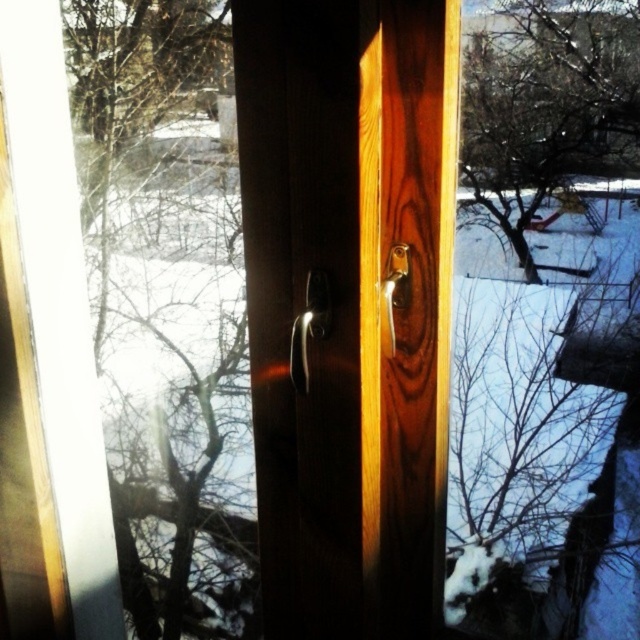
Question: Which is nearer to the satin wood door handle at center?

Choices:
 (A) polished metallic door handle at center
 (B) polished brass door handle at center

Answer: (A)

Question: Is satin wood door handle at center behind polished metallic door handle at center?

Choices:
 (A) no
 (B) yes

Answer: (A)

Question: Is satin wood door handle at center to the left of polished metallic door handle at center from the viewer's perspective?

Choices:
 (A) yes
 (B) no

Answer: (B)

Question: Can you confirm if satin wood door handle at center is thinner than polished brass door handle at center?

Choices:
 (A) no
 (B) yes

Answer: (A)

Question: Which point is farther to the camera?

Choices:
 (A) polished brass door handle at center
 (B) satin wood door handle at center
 (C) polished metallic door handle at center

Answer: (A)

Question: Which point is farther to the camera?

Choices:
 (A) (397, 259)
 (B) (328, 285)
 (C) (371, 131)

Answer: (A)